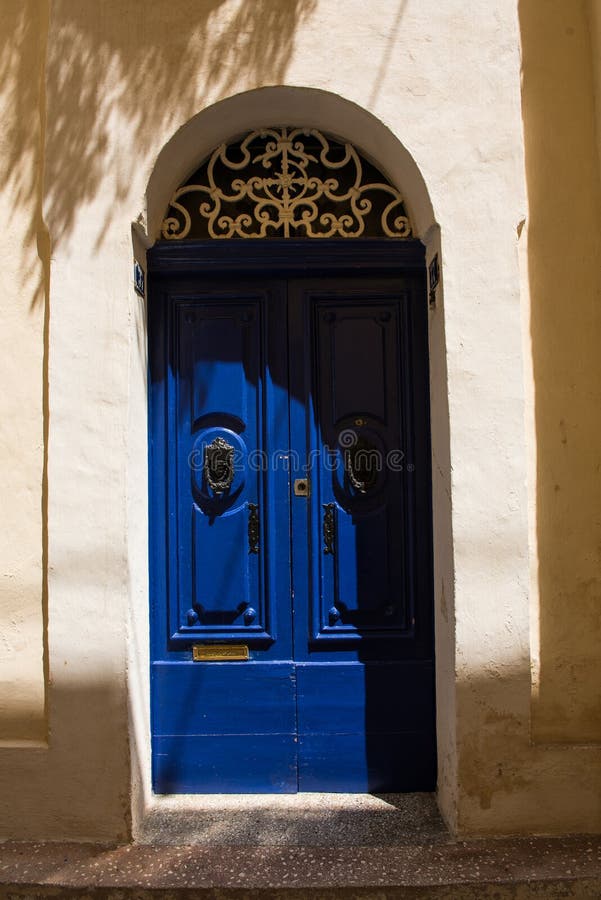
Where is `wall`? wall is located at coordinates (418, 86).